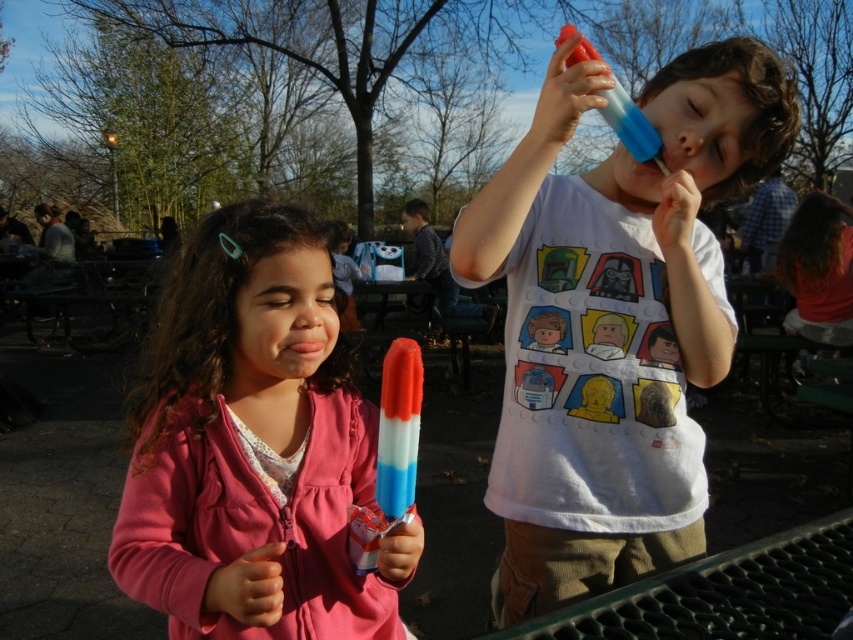
Question: Can you confirm if matte pink jacket at center is positioned to the right of smooth skin nose at center?

Choices:
 (A) yes
 (B) no

Answer: (B)

Question: Can you confirm if white cotton shirt at center is positioned below matte pink jacket at center?

Choices:
 (A) no
 (B) yes

Answer: (A)

Question: Which point is farther to the camera?

Choices:
 (A) (294, 509)
 (B) (570, 477)
 (C) (666, 141)

Answer: (B)

Question: Which object is closer to the camera taking this photo?

Choices:
 (A) white cotton shirt at center
 (B) matte pink jacket at center
 (C) matte pink lips at center

Answer: (B)

Question: Which point is closer to the camera?

Choices:
 (A) (691, 124)
 (B) (322, 349)
 (C) (618, 352)
 (D) (136, 554)

Answer: (D)

Question: Is smooth skin nose at center bigger than matte pink lips at center?

Choices:
 (A) no
 (B) yes

Answer: (A)